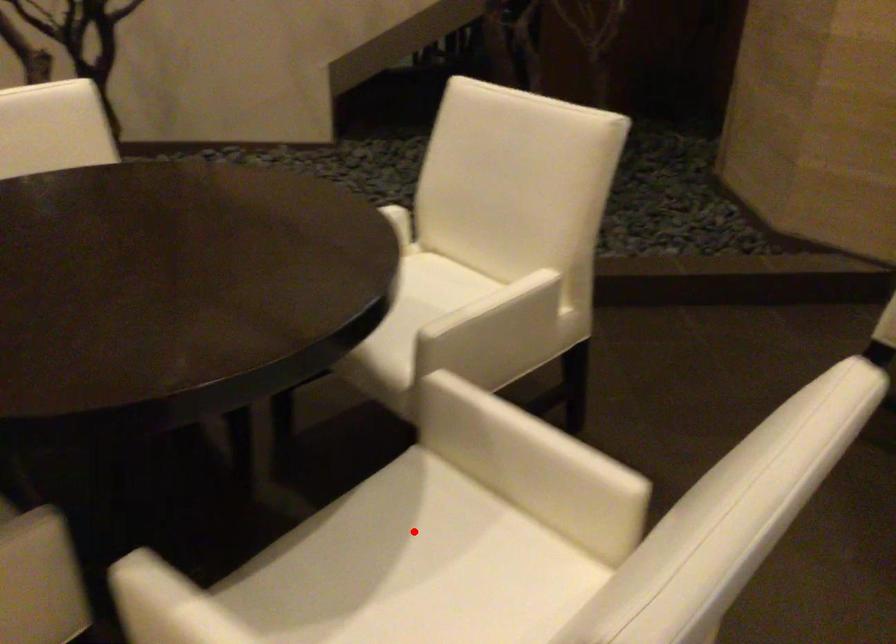
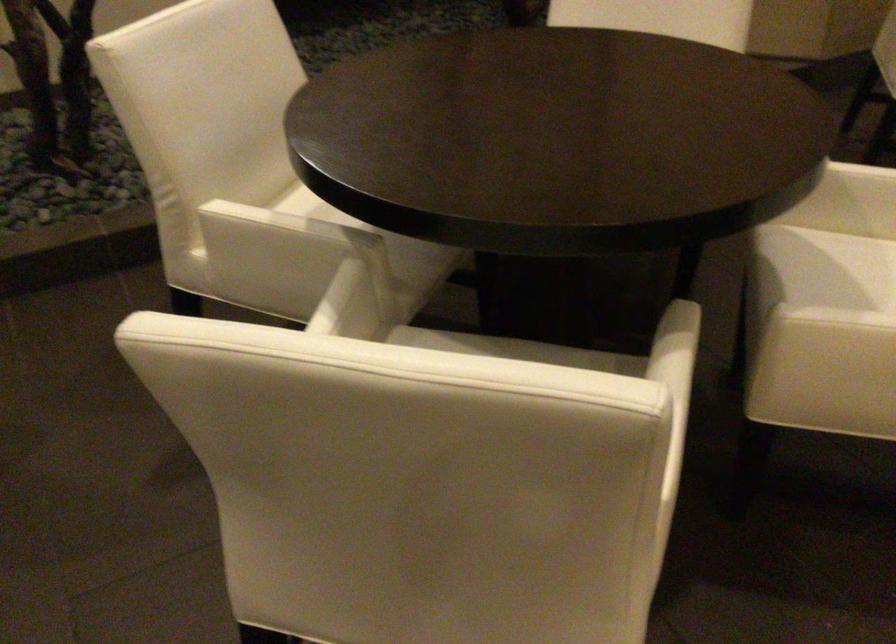
Where in the second image is the point corresponding to the highlighted location from the first image?

(855, 266)